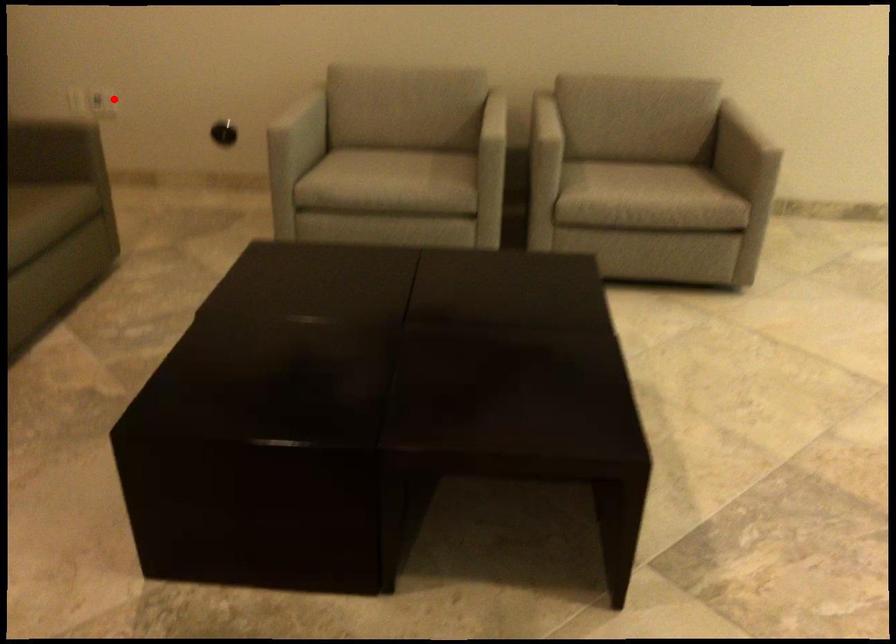
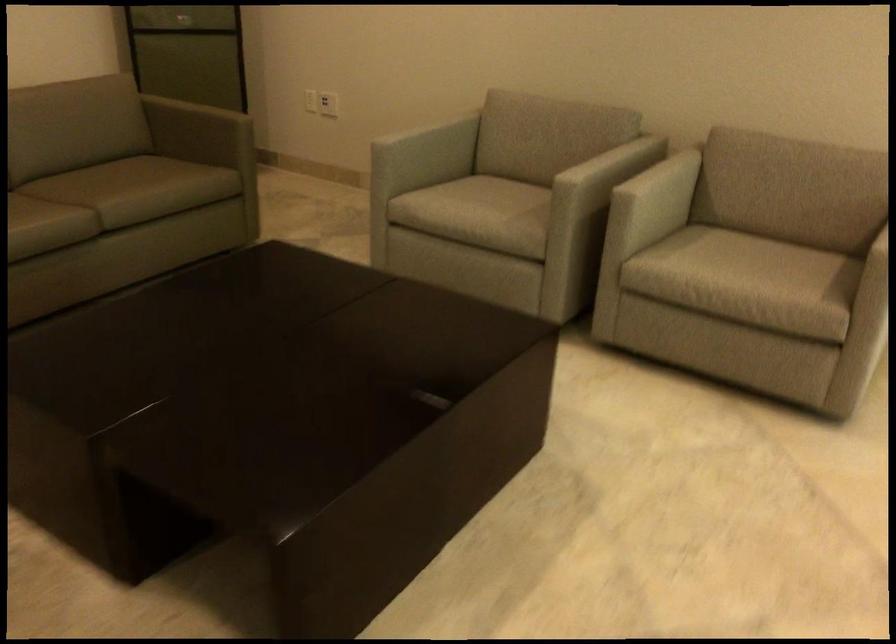
Locate, in the second image, the point that corresponds to the highlighted location in the first image.

(328, 104)